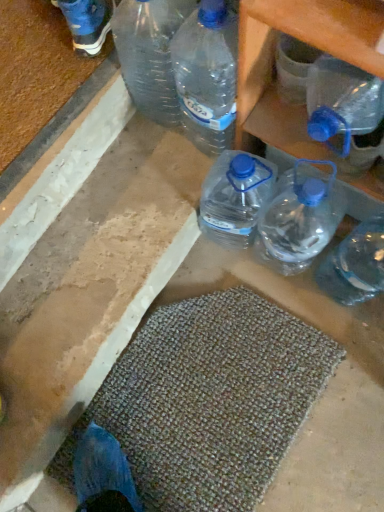
What do you see at coordinates (346, 112) in the screenshot? I see `transparent plastic bottle at upper right, the second bottle in the back-to-front sequence` at bounding box center [346, 112].

Locate an element on the screen. transparent plastic bottle at upper right, which is the 1th bottle in front-to-back order is located at coordinates (346, 112).

How different are the orientations of textured beige bath mat at lower center and transparent plastic bottle at right, the second bottle in the front-to-back sequence, in degrees?

The angular difference between textured beige bath mat at lower center and transparent plastic bottle at right, the second bottle in the front-to-back sequence, is 91.5 degrees.

Is textured beige bath mat at lower center far from transparent plastic bottle at right, the first bottle viewed from the back?

No, textured beige bath mat at lower center is not far away from transparent plastic bottle at right, the first bottle viewed from the back.

From the image's perspective, which one is positioned higher, textured beige bath mat at lower center or transparent plastic bottle at right, the second bottle in the front-to-back sequence?

From the image's view, transparent plastic bottle at right, the second bottle in the front-to-back sequence, is above.

Locate an element on the screen. bath mat that is on the left side of transparent plastic bottle at right, the second bottle in the front-to-back sequence is located at coordinates (208, 400).

Considering the positions of objects transparent plastic bottle at upper right, which is the 1th bottle in front-to-back order, and transparent plastic bottle at right, the second bottle in the front-to-back sequence, in the image provided, who is more to the left, transparent plastic bottle at upper right, which is the 1th bottle in front-to-back order, or transparent plastic bottle at right, the second bottle in the front-to-back sequence,?

transparent plastic bottle at upper right, which is the 1th bottle in front-to-back order, is more to the left.

Considering the sizes of objects transparent plastic bottle at upper right, which is the 1th bottle in front-to-back order, and transparent plastic bottle at right, the first bottle viewed from the back, in the image provided, who is bigger, transparent plastic bottle at upper right, which is the 1th bottle in front-to-back order, or transparent plastic bottle at right, the first bottle viewed from the back,?

transparent plastic bottle at upper right, which is the 1th bottle in front-to-back order, is bigger.

Can transparent plastic bottle at right, the first bottle viewed from the back, be found inside transparent plastic bottle at upper right, which is the 1th bottle in front-to-back order?

No, transparent plastic bottle at right, the first bottle viewed from the back, is located outside of transparent plastic bottle at upper right, which is the 1th bottle in front-to-back order.

This screenshot has width=384, height=512. Find the location of `bottle behind the transparent plastic bottle at upper right, which is the 1th bottle in front-to-back order`. bottle behind the transparent plastic bottle at upper right, which is the 1th bottle in front-to-back order is located at coordinates (355, 264).

Are transparent plastic bottle at right, the first bottle viewed from the back, and transparent plastic bottle at upper right, the second bottle in the back-to-front sequence, making contact?

transparent plastic bottle at right, the first bottle viewed from the back, and transparent plastic bottle at upper right, the second bottle in the back-to-front sequence, are clearly separated.

Is transparent plastic bottle at right, the first bottle viewed from the back, taller than transparent plastic bottle at upper right, the second bottle in the back-to-front sequence?

Yes, transparent plastic bottle at right, the first bottle viewed from the back, is taller than transparent plastic bottle at upper right, the second bottle in the back-to-front sequence.

Can you tell me how much transparent plastic bottle at right, the second bottle in the front-to-back sequence, and transparent plastic bottle at upper right, which is the 1th bottle in front-to-back order, differ in facing direction?

They differ by 0.00323 degrees in their facing directions.

Is transparent plastic bottle at upper right, which is the 1th bottle in front-to-back order, completely or partially inside transparent plastic bottle at right, the first bottle viewed from the back?

No, transparent plastic bottle at upper right, which is the 1th bottle in front-to-back order, is not a part of transparent plastic bottle at right, the first bottle viewed from the back.

Is point (248, 129) positioned behind point (224, 440)?

That is False.

Is transparent plastic bottles at upper right directly adjacent to textured beige bath mat at lower center?

transparent plastic bottles at upper right and textured beige bath mat at lower center are clearly separated.

Can you tell me how much transparent plastic bottles at upper right and textured beige bath mat at lower center differ in facing direction?

The facing directions of transparent plastic bottles at upper right and textured beige bath mat at lower center are 91.5 degrees apart.

Which is more to the left, transparent plastic bottles at upper right or textured beige bath mat at lower center?

From the viewer's perspective, textured beige bath mat at lower center appears more on the left side.

Can you confirm if transparent plastic bottles at upper right is positioned to the left of transparent plastic bottle at upper right, which is the 1th bottle in front-to-back order?

Indeed, transparent plastic bottles at upper right is positioned on the left side of transparent plastic bottle at upper right, which is the 1th bottle in front-to-back order.

In the scene shown: Is transparent plastic bottles at upper right positioned beyond the bounds of transparent plastic bottle at upper right, the second bottle in the back-to-front sequence?

transparent plastic bottles at upper right is positioned outside transparent plastic bottle at upper right, the second bottle in the back-to-front sequence.

Consider the image. From a real-world perspective, is transparent plastic bottles at upper right physically located above or below transparent plastic bottle at upper right, the second bottle in the back-to-front sequence?

transparent plastic bottles at upper right is situated lower than transparent plastic bottle at upper right, the second bottle in the back-to-front sequence, in the real world.

Is transparent plastic bottles at upper right looking in the opposite direction of transparent plastic bottle at upper right, which is the 1th bottle in front-to-back order?

transparent plastic bottles at upper right does not have its back to transparent plastic bottle at upper right, which is the 1th bottle in front-to-back order.

Looking at this image, is transparent plastic bottle at upper right, which is the 1th bottle in front-to-back order, in contact with transparent plastic bottles at upper right?

Yes, transparent plastic bottle at upper right, which is the 1th bottle in front-to-back order, and transparent plastic bottles at upper right clearly make contact.

From the image's perspective, between transparent plastic bottle at upper right, which is the 1th bottle in front-to-back order, and transparent plastic bottles at upper right, which one is located above?

transparent plastic bottles at upper right.

Considering the relative positions of transparent plastic bottle at upper right, the second bottle in the back-to-front sequence, and transparent plastic bottles at upper right in the image provided, is transparent plastic bottle at upper right, the second bottle in the back-to-front sequence, in front of transparent plastic bottles at upper right?

Yes.

Choose the correct answer: Is transparent plastic bottle at upper right, the second bottle in the back-to-front sequence, inside transparent plastic bottles at upper right or outside it?

transparent plastic bottle at upper right, the second bottle in the back-to-front sequence, is not enclosed by transparent plastic bottles at upper right.

This screenshot has height=512, width=384. Find the location of `bath mat that is under the transparent plastic bottles at upper right (from a real-world perspective)`. bath mat that is under the transparent plastic bottles at upper right (from a real-world perspective) is located at coordinates (208, 400).

Consider the image. Is textured beige bath mat at lower center at the right side of transparent plastic bottles at upper right?

No, textured beige bath mat at lower center is not to the right of transparent plastic bottles at upper right.

From the picture: Which object is further away from the camera taking this photo, textured beige bath mat at lower center or transparent plastic bottles at upper right?

textured beige bath mat at lower center.

From the image's perspective, is textured beige bath mat at lower center located above or below transparent plastic bottles at upper right?

Based on their image positions, textured beige bath mat at lower center is located beneath transparent plastic bottles at upper right.

There is a textured beige bath mat at lower center. At what (x,y) coordinates should I click in order to perform the action: click on the 1st bottle above it (from a real-world perspective). Please return your answer as a coordinate pair (x, y). The height and width of the screenshot is (512, 384). Looking at the image, I should click on (355, 264).

Where is `bottle below the transparent plastic bottle at upper right, the second bottle in the back-to-front sequence (from the image's perspective)`? This screenshot has height=512, width=384. bottle below the transparent plastic bottle at upper right, the second bottle in the back-to-front sequence (from the image's perspective) is located at coordinates (355, 264).

When comparing their distances from transparent plastic bottle at upper right, which is the 1th bottle in front-to-back order, does transparent plastic bottle at right, the first bottle viewed from the back, or transparent plastic bottles at upper right seem further?

transparent plastic bottle at right, the first bottle viewed from the back, lies further to transparent plastic bottle at upper right, which is the 1th bottle in front-to-back order, than the other object.

Looking at the image, which one is located closer to transparent plastic bottle at right, the second bottle in the front-to-back sequence, transparent plastic bottles at upper right or transparent plastic bottle at upper right, the second bottle in the back-to-front sequence?

transparent plastic bottle at upper right, the second bottle in the back-to-front sequence, lies closer to transparent plastic bottle at right, the second bottle in the front-to-back sequence, than the other object.

Considering their positions, is transparent plastic bottle at right, the second bottle in the front-to-back sequence, positioned closer to transparent plastic bottle at upper right, the second bottle in the back-to-front sequence, than textured beige bath mat at lower center?

transparent plastic bottle at right, the second bottle in the front-to-back sequence, is closer to transparent plastic bottle at upper right, the second bottle in the back-to-front sequence.

Considering their positions, is transparent plastic bottle at upper right, which is the 1th bottle in front-to-back order, positioned closer to textured beige bath mat at lower center than transparent plastic bottle at right, the second bottle in the front-to-back sequence?

Based on the image, transparent plastic bottle at right, the second bottle in the front-to-back sequence, appears to be nearer to textured beige bath mat at lower center.

Estimate the real-world distances between objects in this image. Which object is closer to transparent plastic bottle at upper right, the second bottle in the back-to-front sequence, transparent plastic bottles at upper right or textured beige bath mat at lower center?

transparent plastic bottles at upper right is positioned closer to the anchor transparent plastic bottle at upper right, the second bottle in the back-to-front sequence.

When comparing their distances from transparent plastic bottles at upper right, does transparent plastic bottle at upper right, the second bottle in the back-to-front sequence, or textured beige bath mat at lower center seem further?

textured beige bath mat at lower center is positioned further to the anchor transparent plastic bottles at upper right.

When comparing their distances from textured beige bath mat at lower center, does transparent plastic bottle at right, the first bottle viewed from the back, or transparent plastic bottles at upper right seem further?

transparent plastic bottles at upper right is positioned further to the anchor textured beige bath mat at lower center.

Which object lies further to the anchor point textured beige bath mat at lower center, transparent plastic bottle at right, the first bottle viewed from the back, or transparent plastic bottle at upper right, which is the 1th bottle in front-to-back order?

transparent plastic bottle at upper right, which is the 1th bottle in front-to-back order.

The image size is (384, 512). In order to click on bottle that lies between transparent plastic bottles at upper right and transparent plastic bottle at right, the second bottle in the front-to-back sequence, from top to bottom in this screenshot , I will do `click(346, 112)`.

Find the location of a particular element. The image size is (384, 512). bottle between transparent plastic bottle at upper right, which is the 1th bottle in front-to-back order, and textured beige bath mat at lower center, in the vertical direction is located at coordinates (355, 264).